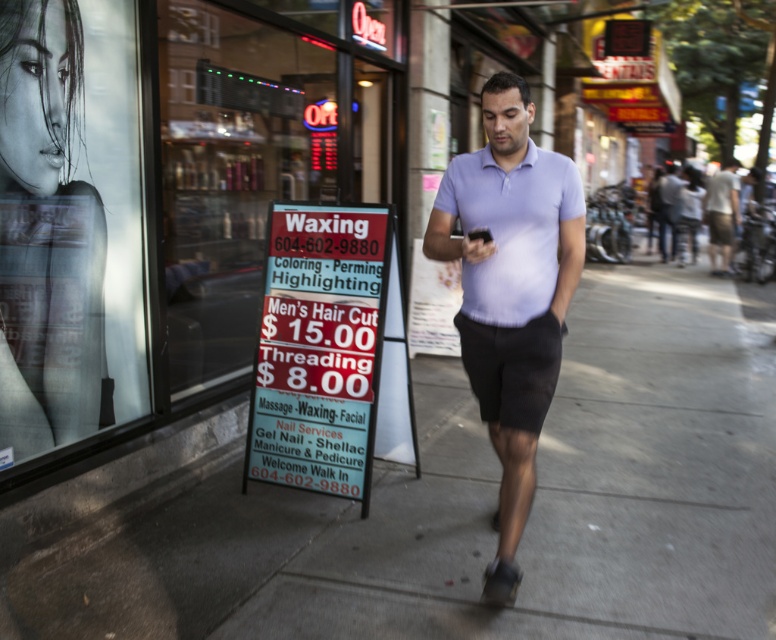
You are a delivery person trying to avoid the rain. You notice the smooth skin portrait at left and the light purple cotton shirt at center. Which object is narrower so you can quickly duck under it while running through the street?

The smooth skin portrait at left has a lesser width compared to the light purple cotton shirt at center, so you should duck under the smooth skin portrait at left since it is narrower.

You are a delivery person who needs to hand a package to the man wearing the light purple cotton shirt at center. The smooth skin portrait at left is blocking your path. Can you walk around it to reach him?

The smooth skin portrait at left is positioned on the left side of light purple cotton shirt at center, so you can walk around the portrait to reach the man wearing the light purple cotton shirt at center.